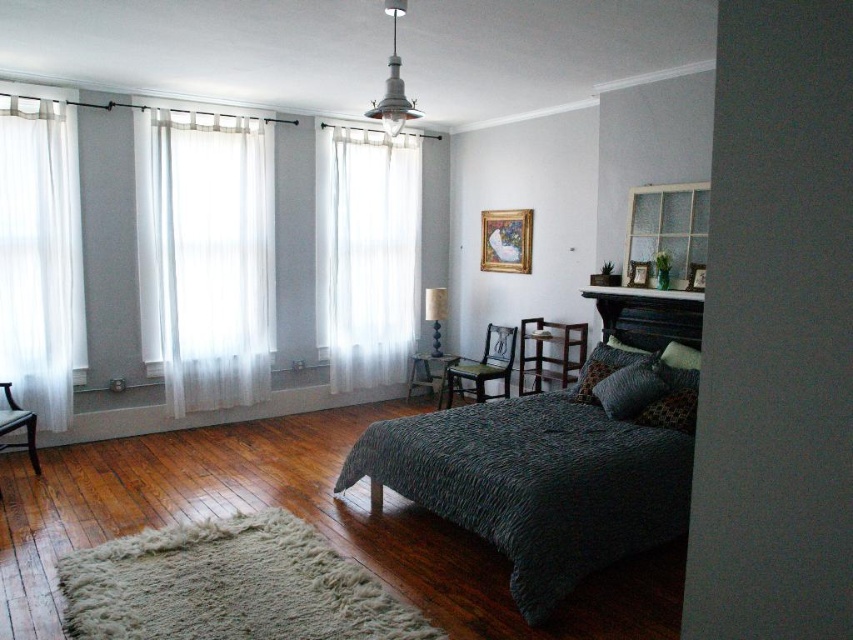
Does white sheer curtain at left have a greater height compared to dark brown wood armchair at lower left?

Yes.

Where is `white sheer curtain at left`? This screenshot has height=640, width=853. white sheer curtain at left is located at coordinates (36, 257).

Does point (16, 332) come closer to viewer compared to point (13, 420)?

No, it is not.

Image resolution: width=853 pixels, height=640 pixels. I want to click on white sheer curtain at left, so click(36, 257).

Does clear glass window at upper right have a smaller size compared to wooden stool at center?

Indeed, clear glass window at upper right has a smaller size compared to wooden stool at center.

Which of these two, clear glass window at upper right or wooden stool at center, stands taller?

clear glass window at upper right

Who is more distant from viewer, (x=668, y=196) or (x=416, y=380)?

Positioned behind is point (x=416, y=380).

Image resolution: width=853 pixels, height=640 pixels. In order to click on clear glass window at upper right in this screenshot , I will do `click(668, 227)`.

Is point (157, 250) behind point (703, 244)?

Yes, it is.

From the picture: Which is below, sheer white curtain at left or clear glass window at upper right?

sheer white curtain at left

The height and width of the screenshot is (640, 853). In order to click on sheer white curtain at left in this screenshot , I will do `click(207, 259)`.